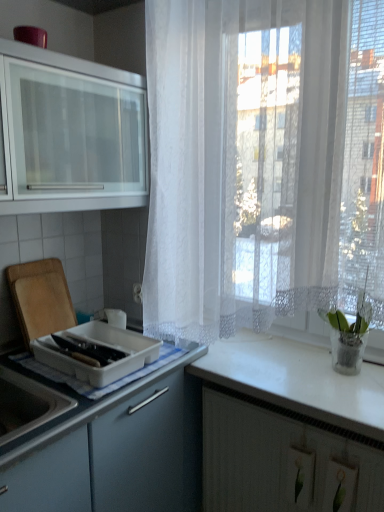
The height and width of the screenshot is (512, 384). Find the location of `free region under green glass vase at right (from a real-world perspective)`. free region under green glass vase at right (from a real-world perspective) is located at coordinates (340, 371).